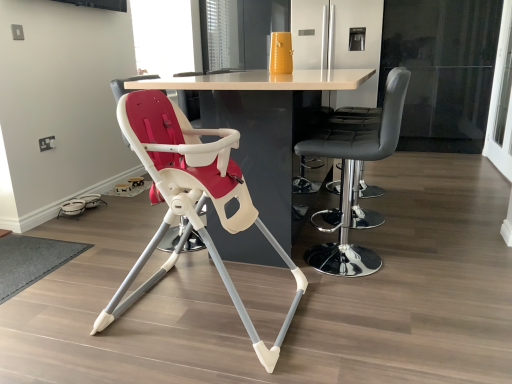
Question: From a real-world perspective, is matte white highchair at center, which appears as the second chair when viewed from the right, positioned over transparent glass screen door at right, which ranks as the second screen door in left-to-right order, based on gravity?

Choices:
 (A) no
 (B) yes

Answer: (A)

Question: Considering the relative sizes of matte white highchair at center, which appears as the second chair when viewed from the right, and transparent glass screen door at right, which appears as the first screen door when viewed from the front, in the image provided, is matte white highchair at center, which appears as the second chair when viewed from the right, shorter than transparent glass screen door at right, which appears as the first screen door when viewed from the front,?

Choices:
 (A) yes
 (B) no

Answer: (A)

Question: Is matte white highchair at center, which is the 1th chair in left-to-right order, not inside transparent glass screen door at right, which ranks as the second screen door in left-to-right order?

Choices:
 (A) no
 (B) yes

Answer: (B)

Question: Considering the relative sizes of matte white highchair at center, which appears as the second chair when viewed from the right, and transparent glass screen door at right, which ranks as the second screen door in left-to-right order, in the image provided, is matte white highchair at center, which appears as the second chair when viewed from the right, smaller than transparent glass screen door at right, which ranks as the second screen door in left-to-right order,?

Choices:
 (A) yes
 (B) no

Answer: (B)

Question: Is matte white highchair at center, which appears as the second chair when viewed from the right, oriented away from transparent glass screen door at right, which appears as the 1th screen door when viewed from the right?

Choices:
 (A) no
 (B) yes

Answer: (A)

Question: In terms of width, does transparent glass screen door at right, which appears as the first screen door when viewed from the front, look wider or thinner when compared to white glossy refrigerator at upper center, the second screen door positioned from the right?

Choices:
 (A) wide
 (B) thin

Answer: (B)

Question: Is transparent glass screen door at right, which ranks as the second screen door in left-to-right order, taller or shorter than white glossy refrigerator at upper center, placed as the 2th screen door when sorted from front to back?

Choices:
 (A) tall
 (B) short

Answer: (A)

Question: Looking at the image, does transparent glass screen door at right, which appears as the 1th screen door when viewed from the right, seem bigger or smaller compared to white glossy refrigerator at upper center, which is the 1th screen door from back to front?

Choices:
 (A) small
 (B) big

Answer: (A)

Question: From the image's perspective, relative to white glossy refrigerator at upper center, marked as the 1th screen door in a left-to-right arrangement, is transparent glass screen door at right, marked as the second screen door in a back-to-front arrangement, above or below?

Choices:
 (A) above
 (B) below

Answer: (B)

Question: Is point (155, 51) positioned closer to the camera than point (506, 18)?

Choices:
 (A) farther
 (B) closer

Answer: (A)

Question: Based on their positions, is transparent glass window screen at upper center located to the left or right of transparent glass screen door at right, which appears as the 1th screen door when viewed from the right?

Choices:
 (A) left
 (B) right

Answer: (A)

Question: Is transparent glass window screen at upper center taller or shorter than transparent glass screen door at right, which appears as the first screen door when viewed from the front?

Choices:
 (A) short
 (B) tall

Answer: (A)

Question: From a real-world perspective, is transparent glass window screen at upper center above or below transparent glass screen door at right, which appears as the first screen door when viewed from the front?

Choices:
 (A) below
 (B) above

Answer: (B)

Question: Is point (270, 89) positioned closer to the camera than point (493, 157)?

Choices:
 (A) farther
 (B) closer

Answer: (B)

Question: Is white glossy table at center taller or shorter than transparent glass screen door at right, which appears as the 1th screen door when viewed from the right?

Choices:
 (A) tall
 (B) short

Answer: (B)